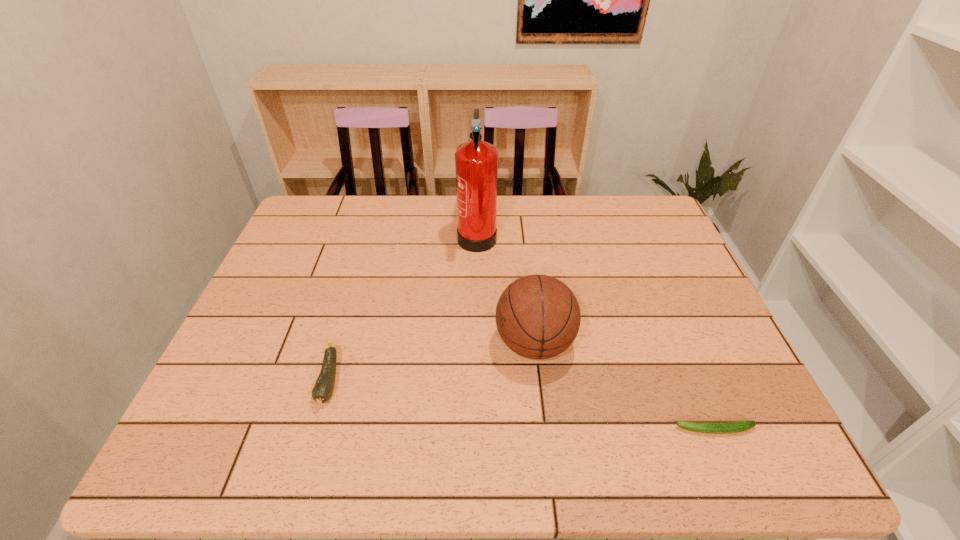
I want to click on the tallest object, so click(x=476, y=162).

The image size is (960, 540). Identify the location of the farthest object. (476, 162).

Where is `the second tallest object`? This screenshot has height=540, width=960. the second tallest object is located at coordinates (537, 316).

At what (x,y) coordinates should I click in order to perform the action: click on the farther zucchini. Please return your answer as a coordinate pair (x, y). Looking at the image, I should click on (323, 388).

Identify the location of the left zucchini. (323, 388).

Identify the location of the shorter zucchini. (740, 426).

Find the location of a particular element. This screenshot has height=540, width=960. the rightmost object is located at coordinates (740, 426).

Identify the location of vacant region located on the right of the farthest object. This screenshot has height=540, width=960. (560, 233).

This screenshot has width=960, height=540. I want to click on blank space located on the side with brand label of the basketball, so click(441, 343).

I want to click on vacant position located 0.060m on the side with brand label of the basketball, so click(x=469, y=343).